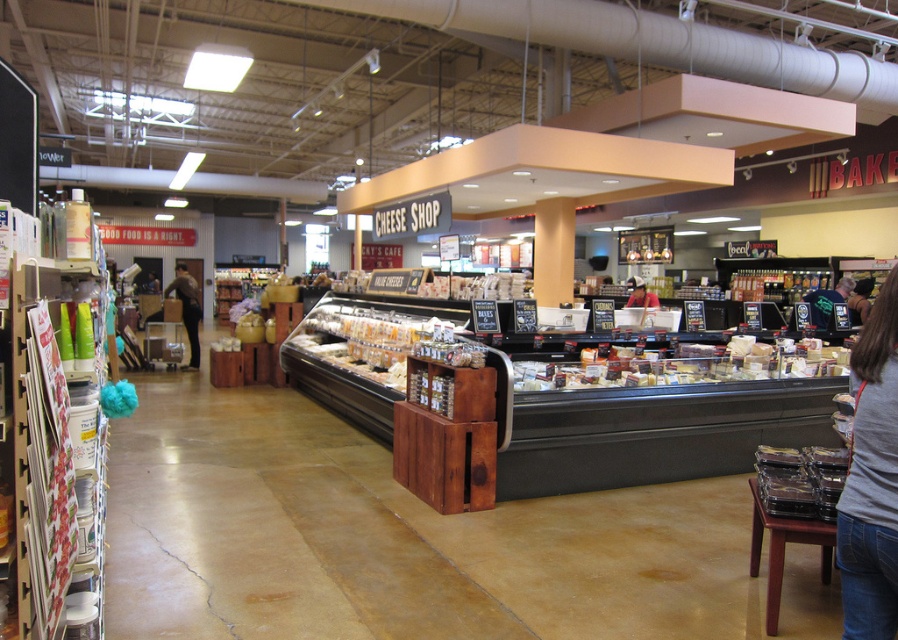
Question: Is brown leather jacket at left to the right of matte red shirt at center from the viewer's perspective?

Choices:
 (A) yes
 (B) no

Answer: (B)

Question: Which point is closer to the camera?

Choices:
 (A) dark brown hair at lower right
 (B) blue fabric bag at center
 (C) brown leather jacket at left
 (D) clear plastic containers at lower right

Answer: (D)

Question: Which point appears closest to the camera in this image?

Choices:
 (A) (848, 305)
 (B) (799, 465)
 (C) (196, 296)
 (D) (643, 288)

Answer: (B)

Question: Can you confirm if translucent plastic containers at center is thinner than clear plastic containers at lower right?

Choices:
 (A) no
 (B) yes

Answer: (A)

Question: Does translucent plastic containers at center have a larger size compared to matte red shirt at center?

Choices:
 (A) no
 (B) yes

Answer: (B)

Question: Which point appears farthest from the camera in this image?

Choices:
 (A) (815, 291)
 (B) (632, 289)
 (C) (595, 348)

Answer: (B)